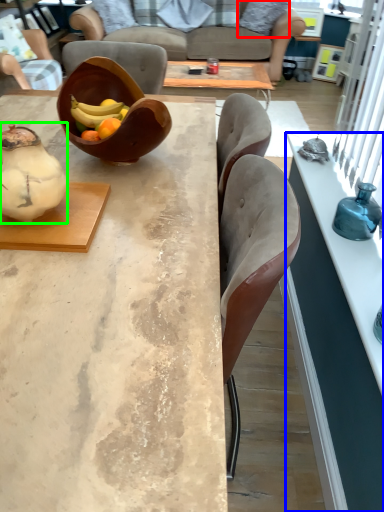
Question: Estimate the real-world distances between objects in this image. Which object is closer to pillow (highlighted by a red box), desk (highlighted by a blue box) or tea pot (highlighted by a green box)?

Choices:
 (A) desk
 (B) tea pot

Answer: (A)